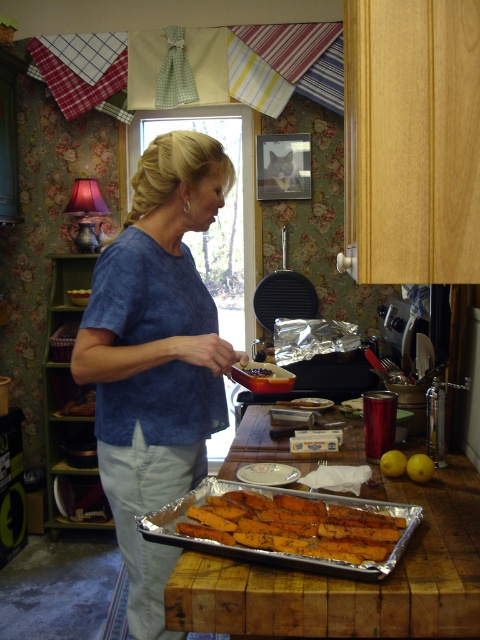
Question: Which point is closer to the camera?

Choices:
 (A) golden brown crispy sticks at lower center
 (B) white glossy platter at center
 (C) brown crispy bread at center
 (D) blue cotton shirt at center

Answer: (A)

Question: Can you confirm if blue cotton shirt at center is bigger than brown crispy bread at center?

Choices:
 (A) no
 (B) yes

Answer: (B)

Question: Which of the following is the closest to the observer?

Choices:
 (A) (112, 316)
 (B) (264, 368)

Answer: (A)

Question: Is golden brown crispy sticks at lower center to the left of brown crispy bread at center from the viewer's perspective?

Choices:
 (A) no
 (B) yes

Answer: (A)

Question: In this image, where is golden brown crispy sticks at lower center located relative to brown crispy bread at center?

Choices:
 (A) left
 (B) right

Answer: (B)

Question: Which of the following is the farthest from the observer?

Choices:
 (A) (259, 368)
 (B) (317, 513)
 (C) (84, 362)

Answer: (A)